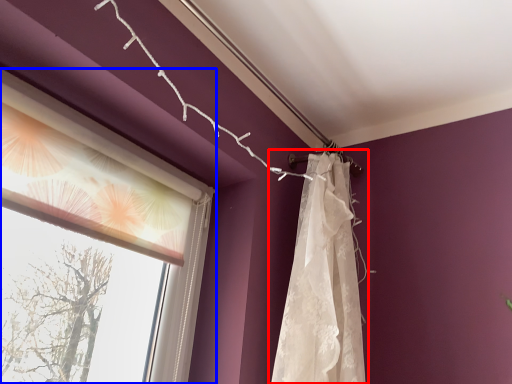
Question: Which point is further to the camera, curtain (highlighted by a red box) or window (highlighted by a blue box)?

Choices:
 (A) curtain
 (B) window

Answer: (A)